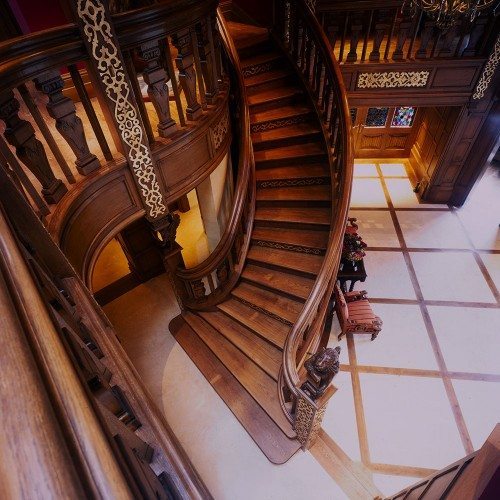
Identify the location of stairs. coord(292,224).